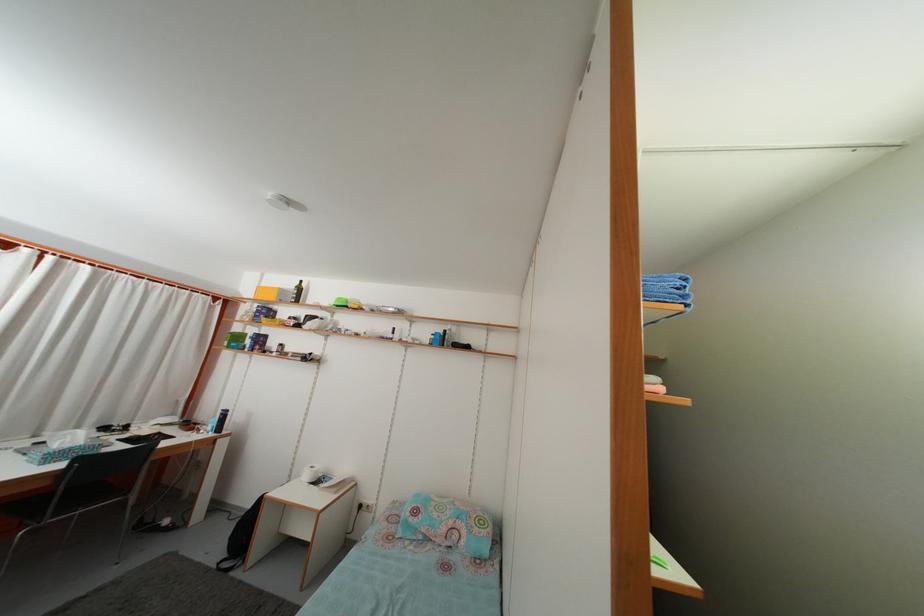
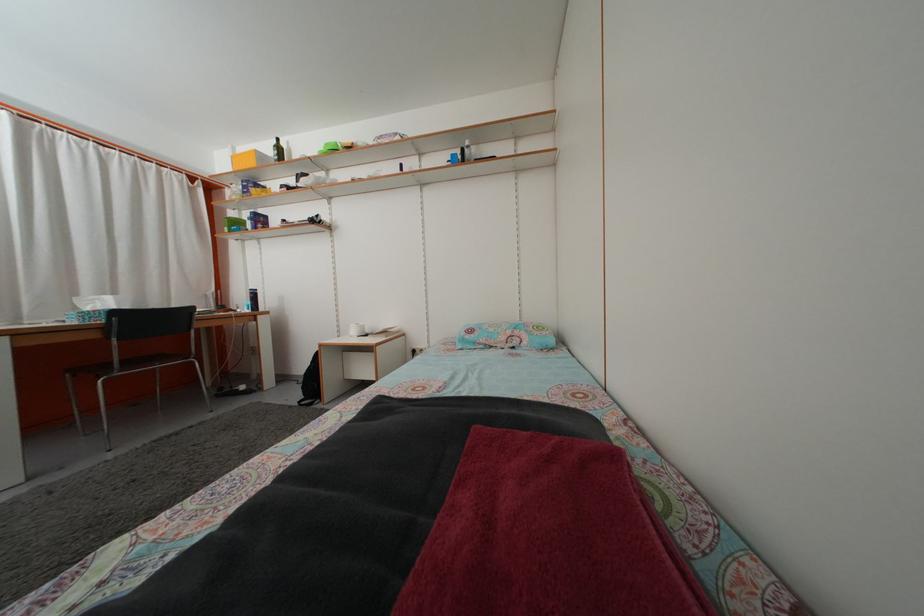
Where in the second image is the point corresponding to point (269, 282) from the first image?

(239, 156)